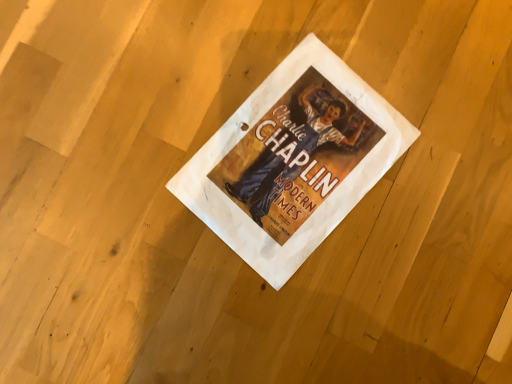
Image resolution: width=512 pixels, height=384 pixels. I want to click on vacant point above white paper poster at center (from a real-world perspective), so click(x=294, y=165).